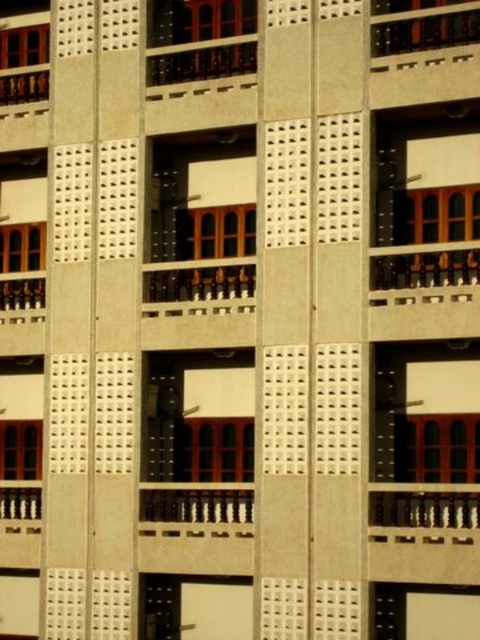
Question: In this image, where is matte brown wood window at lower left located relative to wooden railing at left?

Choices:
 (A) right
 (B) left

Answer: (B)

Question: Can you confirm if matte wood window at upper right is positioned to the right of matte brown wooden window at upper right?

Choices:
 (A) yes
 (B) no

Answer: (A)

Question: Is matte brown wood window at lower left smaller than matte brown wooden window at upper left?

Choices:
 (A) yes
 (B) no

Answer: (A)

Question: Which of the following is the farthest from the observer?

Choices:
 (A) (402, 234)
 (B) (160, 20)
 (C) (16, 449)

Answer: (C)

Question: Which object is the farthest from the dark brown wooden balcony at upper center?

Choices:
 (A) matte wood window at upper right
 (B) wooden railing at left
 (C) matte brown wooden window at left
 (D) matte wood window at upper center

Answer: (B)

Question: Which object is the closest to the wooden railing at left?

Choices:
 (A) matte brown wooden window at left
 (B) matte wood window at center
 (C) matte brown wooden window at upper right

Answer: (A)